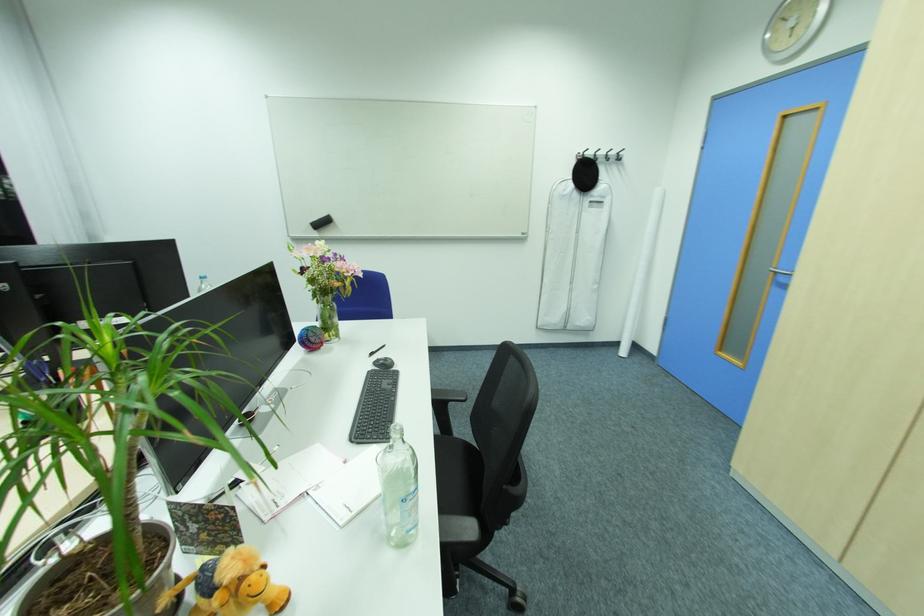
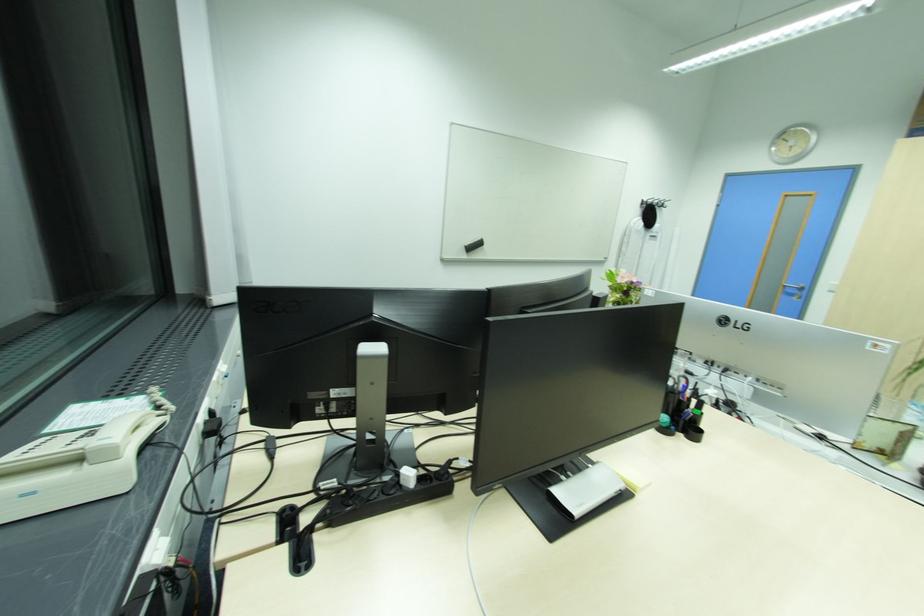
Find the pixel in the second image that matches the point at 317,222 in the first image.

(470, 245)